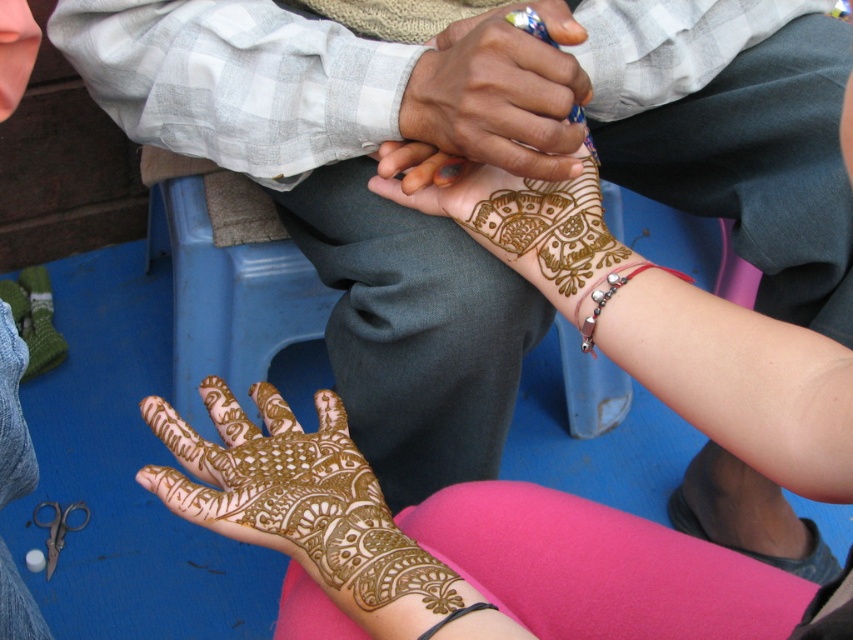
Question: Which point is farther from the camera taking this photo?

Choices:
 (A) (584, 324)
 (B) (146, 404)
 (C) (556, 52)

Answer: (B)

Question: Which point is closer to the camera?

Choices:
 (A) brown henna at center
 (B) brown henna tattoo at center
 (C) silver metallic bracelet at lower right
 (D) silver metallic bracelet at lower center

Answer: (D)

Question: Which point is closer to the camera?

Choices:
 (A) (285, 509)
 (B) (579, 298)
 (C) (456, 80)

Answer: (A)

Question: Does brown henna tattoo at center appear on the right side of brown henna at center?

Choices:
 (A) yes
 (B) no

Answer: (B)

Question: Does silver metallic bracelet at lower right appear under silver metallic bracelet at lower center?

Choices:
 (A) yes
 (B) no

Answer: (B)

Question: Does brown henna tattoo at center have a greater width compared to brown henna at center?

Choices:
 (A) yes
 (B) no

Answer: (A)